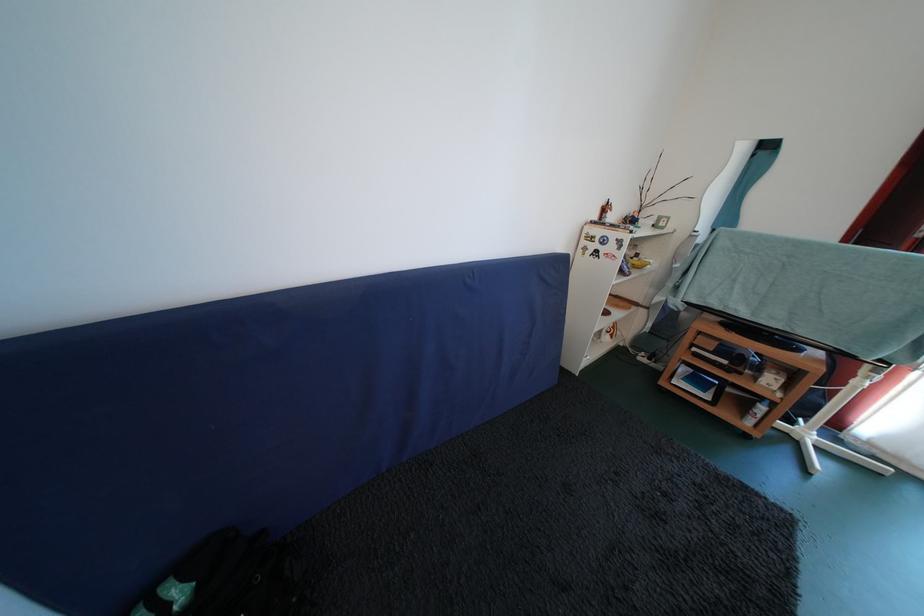
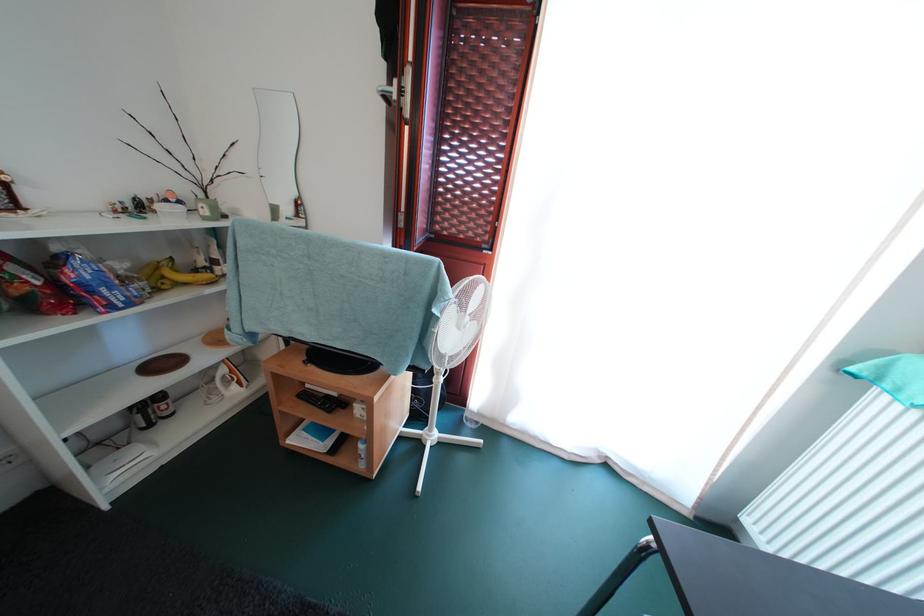
Locate, in the second image, the point that corresponds to (701,354) in the first image.

(314, 391)